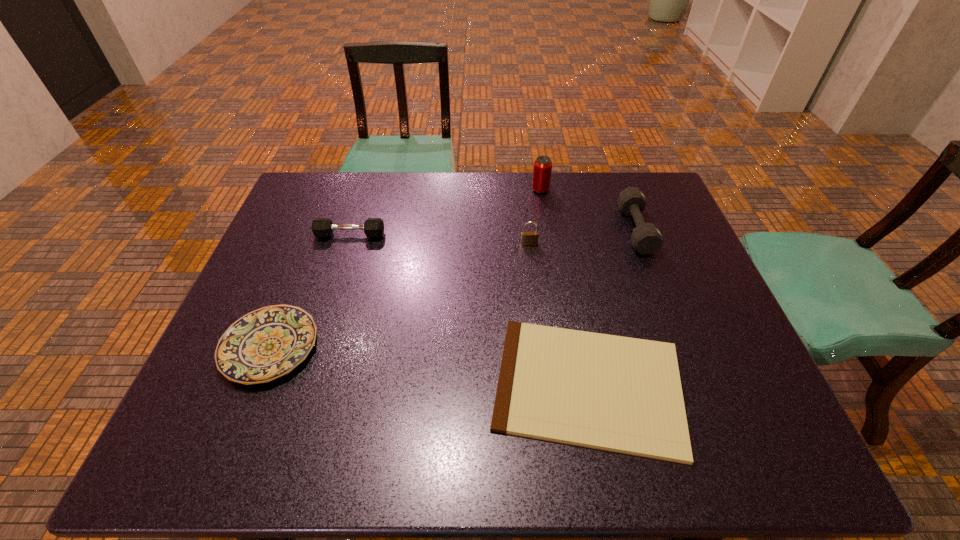
Identify the location of free space that is in between the left dumbbell and the second shortest object. (310, 291).

This screenshot has width=960, height=540. In order to click on empty space between the plate and the shortest object in this screenshot , I will do `click(429, 366)`.

I want to click on empty location between the left dumbbell and the fifth tallest object, so click(x=310, y=291).

Locate an element on the screen. vacant area between the clipboard and the plate is located at coordinates point(429,366).

Identify the location of free area in between the right dumbbell and the shorter dumbbell. This screenshot has width=960, height=540. (492, 232).

This screenshot has height=540, width=960. Identify the location of free spot between the shorter dumbbell and the padlock. (440, 239).

Where is `object that stands as the closest to the clipboard`? This screenshot has height=540, width=960. object that stands as the closest to the clipboard is located at coordinates (646, 238).

Where is `object that can be found as the fifth closest to the plate`? object that can be found as the fifth closest to the plate is located at coordinates click(x=646, y=238).

This screenshot has width=960, height=540. Find the location of `vacant space that satisfies the following two spatial constraints: 1. on the front side of the shortest object; 2. on the right side of the shorter dumbbell`. vacant space that satisfies the following two spatial constraints: 1. on the front side of the shortest object; 2. on the right side of the shorter dumbbell is located at coordinates point(302,386).

Locate an element on the screen. vacant point that satisfies the following two spatial constraints: 1. on the front-facing side of the clipboard; 2. on the right side of the padlock is located at coordinates (545, 386).